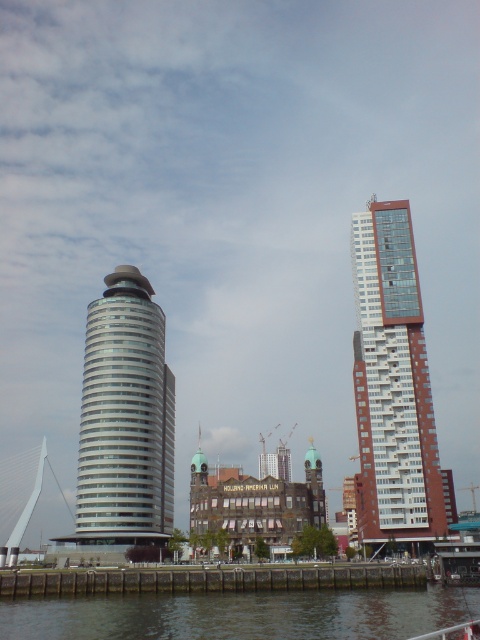
Who is more distant from viewer, (406, 468) or (399, 612)?

The point (406, 468) is behind.

Is white glass building at right in front of smooth concrete wall at lower center?

No, it is not.

Is point (379, 365) closer to viewer compared to point (122, 600)?

No, it is behind (122, 600).

You are a GUI agent. You are given a task and a screenshot of the screen. Output one action in this format:
    pyautogui.click(x=<x>, y=<y>)
    Task: Click on the white glass building at right
    
    Given the screenshot: What is the action you would take?
    pyautogui.click(x=393, y=384)

Does white glossy tower at center come in front of smooth concrete wall at lower center?

No, it is not.

Between white glossy tower at center and smooth concrete wall at lower center, which one has less height?

Standing shorter between the two is smooth concrete wall at lower center.

Locate an element on the screen. Image resolution: width=480 pixels, height=640 pixels. white glossy tower at center is located at coordinates (126, 417).

Between white glass building at right and white glossy tower at center, which one is positioned higher?

white glass building at right is higher up.

The width and height of the screenshot is (480, 640). Describe the element at coordinates (393, 384) in the screenshot. I see `white glass building at right` at that location.

What are the coordinates of `white glass building at right` in the screenshot? It's located at (393, 384).